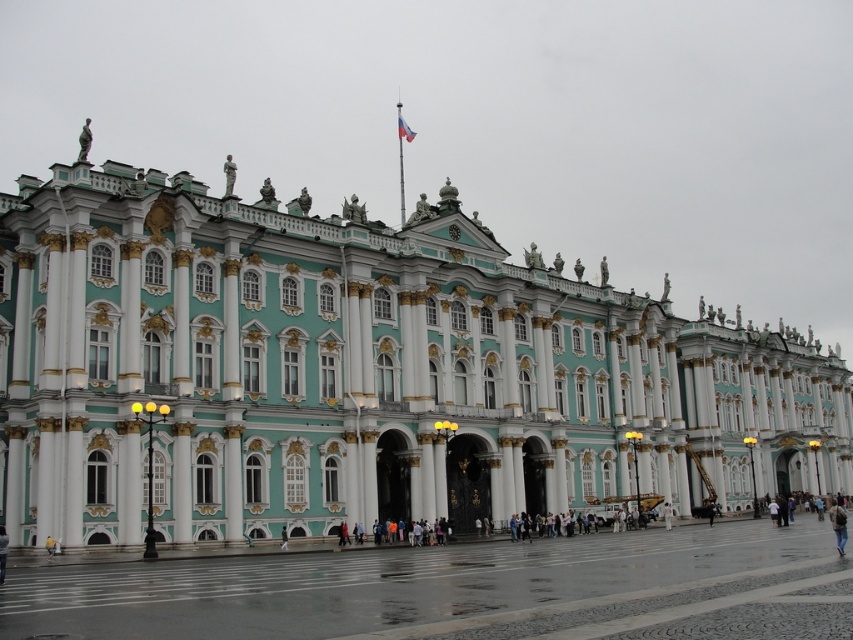
Does teal/golden stone building at center have a lesser height compared to polished stone plaza at center?

No, teal/golden stone building at center is not shorter than polished stone plaza at center.

This screenshot has height=640, width=853. I want to click on teal/golden stone building at center, so click(363, 372).